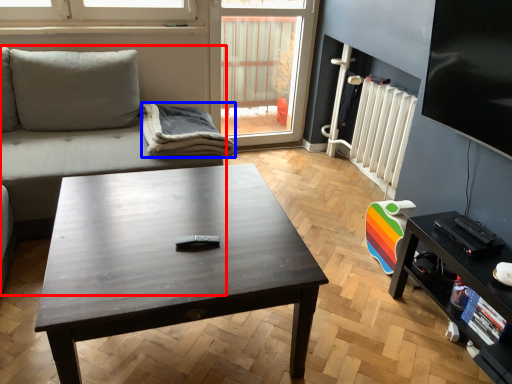
Question: Which object appears farthest to the camera in this image, studio couch (highlighted by a red box) or blanket (highlighted by a blue box)?

Choices:
 (A) studio couch
 (B) blanket

Answer: (B)